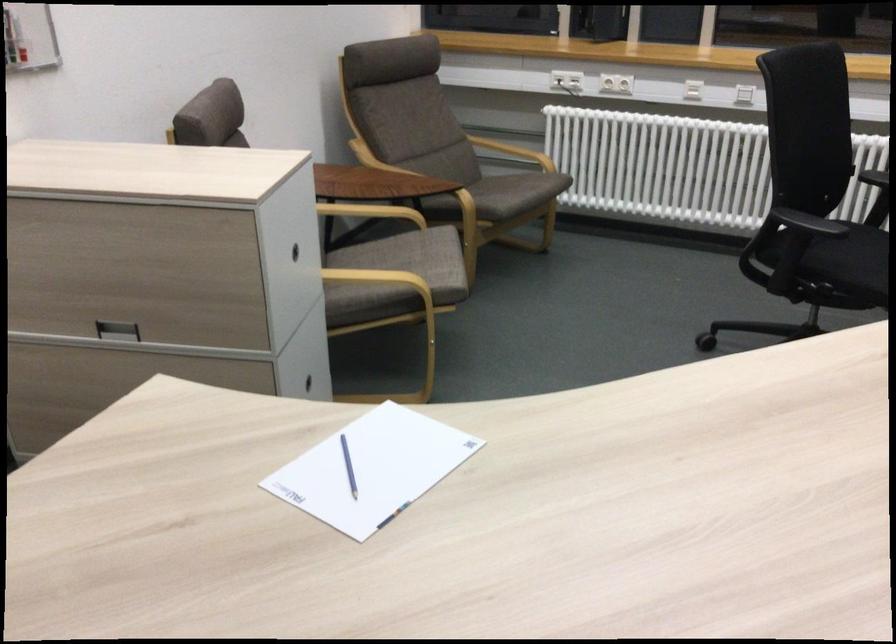
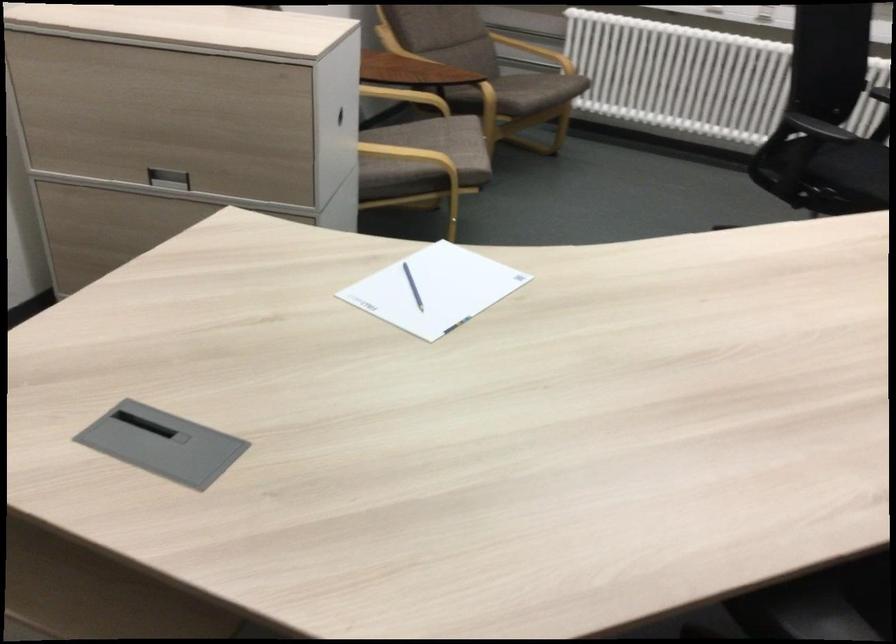
Question: The images are taken continuously from a first-person perspective. In which direction is your viewpoint rotating?

Choices:
 (A) Left
 (B) Right
 (C) Up
 (D) Down

Answer: (D)